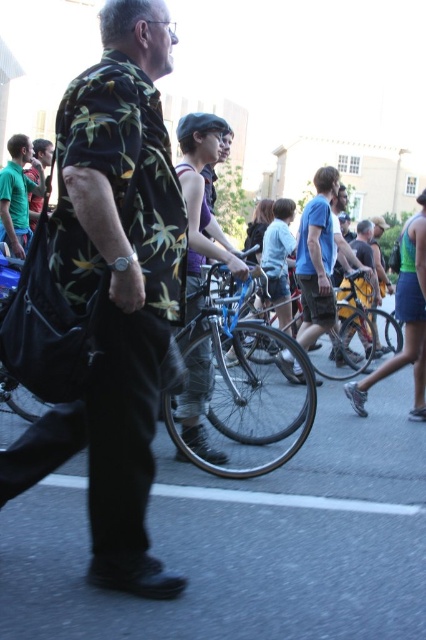
You are organizing a parade route and need to ensure that the shiny blue bicycle at center and the matte purple tank top at center can pass through a narrow alleyway. The alleyway is only wide enough for items up to the width of the narrower of the two. Which object determines the maximum allowable width for the alleyway?

The alleyway must accommodate the narrower of the two objects. Since the shiny blue bicycle at center is wider than the matte purple tank top at center, the width of the matte purple tank top at center determines the maximum allowable width for the alleyway.